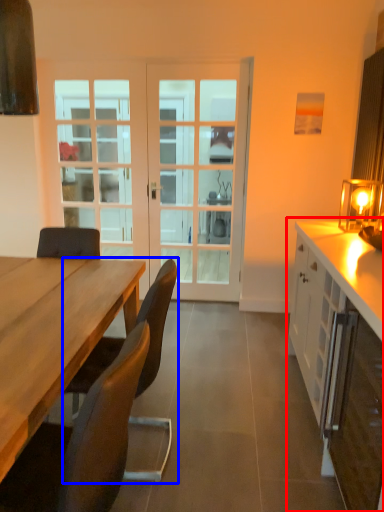
Question: Among these objects, which one is nearest to the camera, cabinetry (highlighted by a red box) or chair (highlighted by a blue box)?

Choices:
 (A) cabinetry
 (B) chair

Answer: (B)